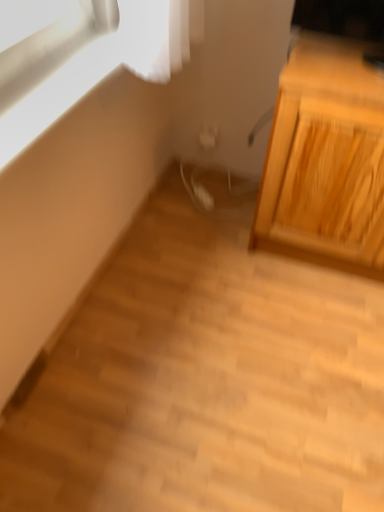
Question: Does light wood cabinet at right contain matte white window at upper left?

Choices:
 (A) yes
 (B) no

Answer: (B)

Question: Considering the relative positions of light wood cabinet at right and matte white window at upper left in the image provided, is light wood cabinet at right behind matte white window at upper left?

Choices:
 (A) no
 (B) yes

Answer: (B)

Question: Is light wood cabinet at right positioned with its back to matte white window at upper left?

Choices:
 (A) yes
 (B) no

Answer: (B)

Question: Can you confirm if light wood cabinet at right is taller than matte white window at upper left?

Choices:
 (A) no
 (B) yes

Answer: (B)

Question: Can you confirm if light wood cabinet at right is shorter than matte white window at upper left?

Choices:
 (A) no
 (B) yes

Answer: (A)

Question: Can you confirm if light wood cabinet at right is thinner than matte white window at upper left?

Choices:
 (A) no
 (B) yes

Answer: (A)

Question: Does matte white window at upper left come behind light wood cabinet at right?

Choices:
 (A) no
 (B) yes

Answer: (A)

Question: Is the depth of matte white window at upper left less than that of light wood cabinet at right?

Choices:
 (A) no
 (B) yes

Answer: (B)

Question: Does matte white window at upper left have a greater width compared to light wood cabinet at right?

Choices:
 (A) yes
 (B) no

Answer: (B)

Question: Can you confirm if matte white window at upper left is thinner than light wood cabinet at right?

Choices:
 (A) no
 (B) yes

Answer: (B)

Question: From the image's perspective, is matte white window at upper left under light wood cabinet at right?

Choices:
 (A) no
 (B) yes

Answer: (A)

Question: Is matte white window at upper left not inside light wood cabinet at right?

Choices:
 (A) no
 (B) yes

Answer: (B)

Question: Looking at their shapes, would you say light wood cabinet at right is wider or thinner than matte white window at upper left?

Choices:
 (A) thin
 (B) wide

Answer: (B)